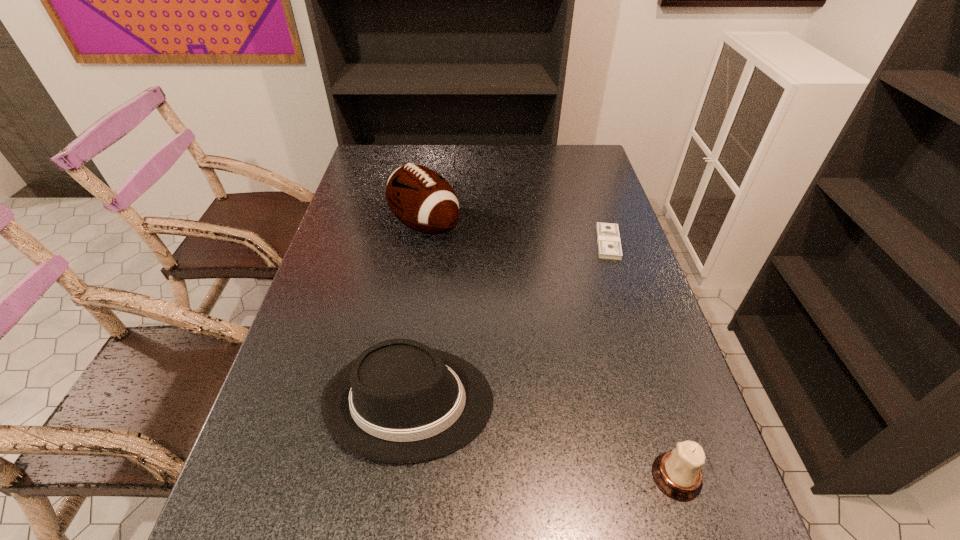
At what (x,y) coordinates should I click in order to perform the action: click on vacant area that satisfies the following two spatial constraints: 1. on the front-facing side of the candle holder; 2. on the right side of the fedora. Please return your answer as a coordinate pair (x, y). Looking at the image, I should click on (399, 476).